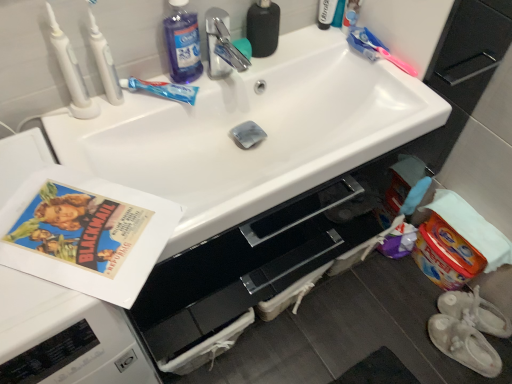
Locate an element on the screen. vintage paper at left is located at coordinates (86, 233).

How much space does translucent blue toothpaste at upper center, placed as the second toothbrush when sorted from right to left, occupy horizontally?

It is 2.33 inches.

The image size is (512, 384). Describe the element at coordinates (104, 62) in the screenshot. I see `white plastic toothbrush at upper left, placed as the 3th toothbrush when sorted from right to left` at that location.

What is the approximate width of black matte bottle at upper center?

It is 2.01 inches.

Describe the element at coordinates (464, 344) in the screenshot. I see `white fabric slipper at lower right, the second footwear from the back` at that location.

This screenshot has height=384, width=512. What do you see at coordinates (475, 312) in the screenshot?
I see `white fabric baby shoes at lower right, which is the 2th footwear in front-to-back order` at bounding box center [475, 312].

At what (x,y) coordinates should I click in order to perform the action: click on vintage paper at left. Please return your answer as a coordinate pair (x, y). The image size is (512, 384). Looking at the image, I should click on [x=86, y=233].

Which object is closer to the camera, white plastic toothbrush at upper left, which ranks as the first toothbrush in left-to-right order, or white glossy sink at center?

white glossy sink at center.

Can you confirm if white plastic toothbrush at upper left, arranged as the fourth toothbrush when viewed from the right, is wider than white glossy sink at center?

In fact, white plastic toothbrush at upper left, arranged as the fourth toothbrush when viewed from the right, might be narrower than white glossy sink at center.

Is white plastic toothbrush at upper left, which ranks as the first toothbrush in left-to-right order, positioned with its back to white glossy sink at center?

white plastic toothbrush at upper left, which ranks as the first toothbrush in left-to-right order, does not have its back to white glossy sink at center.

Is white plastic toothbrush at upper left, arranged as the fourth toothbrush when viewed from the right, not near white glossy sink at center?

No.

Is translucent blue toothpaste at upper center, which is counted as the third toothbrush, starting from the left, further to camera compared to white plastic toothbrush at upper left, the second toothbrush viewed from the left?

Yes, it is behind white plastic toothbrush at upper left, the second toothbrush viewed from the left.

Which point is more distant from viewer, [187,89] or [104,85]?

Positioned behind is point [187,89].

Does translucent blue toothpaste at upper center, which is counted as the third toothbrush, starting from the left, appear on the right side of white plastic toothbrush at upper left, the second toothbrush viewed from the left?

Yes, translucent blue toothpaste at upper center, which is counted as the third toothbrush, starting from the left, is to the right of white plastic toothbrush at upper left, the second toothbrush viewed from the left.

From the picture: Is translucent blue toothpaste at upper center, placed as the second toothbrush when sorted from right to left, looking in the opposite direction of white plastic toothbrush at upper left, placed as the 3th toothbrush when sorted from right to left?

No, white plastic toothbrush at upper left, placed as the 3th toothbrush when sorted from right to left, is not at the back of translucent blue toothpaste at upper center, placed as the second toothbrush when sorted from right to left.

Is white fabric slipper at lower right, the 1th footwear viewed from the front, bigger than white fabric baby shoes at lower right, which is the 2th footwear in front-to-back order?

Correct, white fabric slipper at lower right, the 1th footwear viewed from the front, is larger in size than white fabric baby shoes at lower right, which is the 2th footwear in front-to-back order.

Is white fabric slipper at lower right, the 1th footwear viewed from the front, taller or shorter than white fabric baby shoes at lower right, marked as the 1th footwear in a back-to-front arrangement?

In the image, white fabric slipper at lower right, the 1th footwear viewed from the front, appears to be taller than white fabric baby shoes at lower right, marked as the 1th footwear in a back-to-front arrangement.

The image size is (512, 384). I want to click on footwear that is above the white fabric slipper at lower right, the 1th footwear viewed from the front (from the image's perspective), so click(x=475, y=312).

Does white fabric slipper at lower right, the second footwear from the back, appear on the right side of white fabric baby shoes at lower right, which is the 2th footwear in front-to-back order?

No, white fabric slipper at lower right, the second footwear from the back, is not to the right of white fabric baby shoes at lower right, which is the 2th footwear in front-to-back order.

From the image's perspective, which one is positioned higher, white fabric baby shoes at lower right, marked as the 1th footwear in a back-to-front arrangement, or white plastic tube at upper right?

white plastic tube at upper right.

How different are the orientations of white fabric baby shoes at lower right, marked as the 1th footwear in a back-to-front arrangement, and white plastic tube at upper right in degrees?

The angular difference between white fabric baby shoes at lower right, marked as the 1th footwear in a back-to-front arrangement, and white plastic tube at upper right is 122 degrees.

Considering the relative positions of white fabric baby shoes at lower right, which is the 2th footwear in front-to-back order, and white plastic tube at upper right in the image provided, is white fabric baby shoes at lower right, which is the 2th footwear in front-to-back order, behind white plastic tube at upper right?

Yes, white fabric baby shoes at lower right, which is the 2th footwear in front-to-back order, is behind white plastic tube at upper right.

Does point (500, 331) come behind point (331, 20)?

Yes.

Which of these two, white plastic tube at upper right or vintage paper at left, is smaller?

white plastic tube at upper right.

Is white plastic tube at upper right in contact with vintage paper at left?

No.

Based on the photo, is white plastic tube at upper right taller or shorter than vintage paper at left?

Clearly, white plastic tube at upper right is taller compared to vintage paper at left.

Considering the relative sizes of white plastic tube at upper right and vintage paper at left in the image provided, is white plastic tube at upper right wider than vintage paper at left?

In fact, white plastic tube at upper right might be narrower than vintage paper at left.

Is white fabric slipper at lower right, the second footwear from the back, in contact with white plastic tube at upper right?

No.

Locate an element on the screen. This screenshot has height=384, width=512. toiletry that appears in front of the white fabric slipper at lower right, the second footwear from the back is located at coordinates (326, 13).

Between point (467, 332) and point (328, 23), which one is positioned in front?

Point (328, 23)

Who is taller, white fabric slipper at lower right, the 1th footwear viewed from the front, or white plastic tube at upper right?

white plastic tube at upper right is taller.

Considering the sizes of objects white fabric baby shoes at lower right, which is the 2th footwear in front-to-back order, and blue liquid at upper left in the image provided, who is bigger, white fabric baby shoes at lower right, which is the 2th footwear in front-to-back order, or blue liquid at upper left?

white fabric baby shoes at lower right, which is the 2th footwear in front-to-back order.

This screenshot has width=512, height=384. I want to click on cleaning product above the white fabric baby shoes at lower right, which is the 2th footwear in front-to-back order (from a real-world perspective), so click(183, 43).

Which of these two, white fabric baby shoes at lower right, which is the 2th footwear in front-to-back order, or blue liquid at upper left, stands taller?

Standing taller between the two is blue liquid at upper left.

In order to click on sink that is on the right side of white plastic toothbrush at upper left, which ranks as the first toothbrush in left-to-right order in this screenshot , I will do `click(261, 126)`.

The height and width of the screenshot is (384, 512). I want to click on toothbrush that is the 1st one below the white plastic toothbrush at upper left, the second toothbrush viewed from the left (from a real-world perspective), so click(163, 89).

From the picture: Considering their positions, is translucent blue toothpaste at upper center, placed as the second toothbrush when sorted from right to left, positioned further to white plastic tube at upper right than white plastic toothbrush at upper left, the second toothbrush viewed from the left?

The object further to white plastic tube at upper right is white plastic toothbrush at upper left, the second toothbrush viewed from the left.

Based on their spatial positions, is white plastic toothbrush at upper left, the second toothbrush viewed from the left, or black matte bottle at upper center further from translucent blue toothpaste at upper center, placed as the second toothbrush when sorted from right to left?

black matte bottle at upper center is positioned further to the anchor translucent blue toothpaste at upper center, placed as the second toothbrush when sorted from right to left.

Estimate the real-world distances between objects in this image. Which object is further from white plastic tube at upper right, white plastic toothbrush at upper left, arranged as the fourth toothbrush when viewed from the right, or white plastic toothbrush at upper left, placed as the 3th toothbrush when sorted from right to left?

white plastic toothbrush at upper left, arranged as the fourth toothbrush when viewed from the right, lies further to white plastic tube at upper right than the other object.

In the scene shown: Estimate the real-world distances between objects in this image. Which object is closer to translucent blue toothpaste at upper center, which is counted as the third toothbrush, starting from the left, white plastic toothbrush at upper left, which ranks as the first toothbrush in left-to-right order, or white plastic toothbrush at upper left, placed as the 3th toothbrush when sorted from right to left?

white plastic toothbrush at upper left, placed as the 3th toothbrush when sorted from right to left, is positioned closer to the anchor translucent blue toothpaste at upper center, which is counted as the third toothbrush, starting from the left.

Looking at the image, which one is located closer to translucent blue toothpaste at upper center, which is counted as the third toothbrush, starting from the left, blue liquid at upper left or vintage paper at left?

Based on the image, blue liquid at upper left appears to be nearer to translucent blue toothpaste at upper center, which is counted as the third toothbrush, starting from the left.

When comparing their distances from white plastic tube at upper right, does black matte bottle at upper center or white glossy sink at center seem closer?

black matte bottle at upper center is positioned closer to the anchor white plastic tube at upper right.

Looking at the image, which one is located closer to translucent blue toothpaste at upper center, which is counted as the third toothbrush, starting from the left, white plastic tube at upper right or white fabric baby shoes at lower right, marked as the 1th footwear in a back-to-front arrangement?

white plastic tube at upper right lies closer to translucent blue toothpaste at upper center, which is counted as the third toothbrush, starting from the left, than the other object.

When comparing their distances from black matte bottle at upper center, does white plastic toothbrush at upper left, which ranks as the first toothbrush in left-to-right order, or white glossy sink at center seem further?

white plastic toothbrush at upper left, which ranks as the first toothbrush in left-to-right order, is positioned further to the anchor black matte bottle at upper center.

The height and width of the screenshot is (384, 512). Identify the location of paperback book between white plastic toothbrush at upper left, the second toothbrush viewed from the left, and white fabric baby shoes at lower right, which is the 2th footwear in front-to-back order, in the horizontal direction. (86, 233).

The image size is (512, 384). Identify the location of footwear between white glossy sink at center and white fabric baby shoes at lower right, which is the 2th footwear in front-to-back order. (464, 344).

The width and height of the screenshot is (512, 384). What are the coordinates of `sink located between translucent blue toothpaste at upper center, placed as the second toothbrush when sorted from right to left, and white fabric slipper at lower right, the second footwear from the back, in the left-right direction` in the screenshot? It's located at (261, 126).

The height and width of the screenshot is (384, 512). I want to click on mouthwash situated between white glossy sink at center and pink plastic toothbrush at upper right, which is the fourth toothbrush from left to right, from left to right, so click(263, 27).